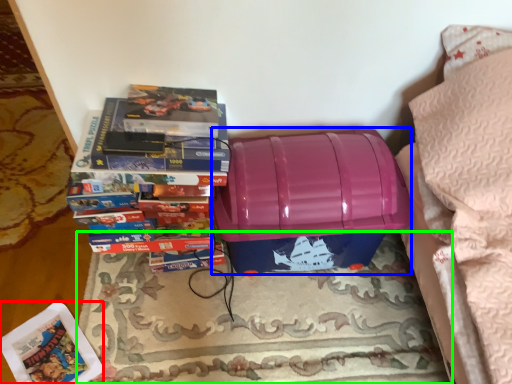
Question: Which object is positioned closest to paperback book (highlighted by a red box)? Select from storage box (highlighted by a blue box) and mat (highlighted by a green box).

Choices:
 (A) storage box
 (B) mat

Answer: (B)